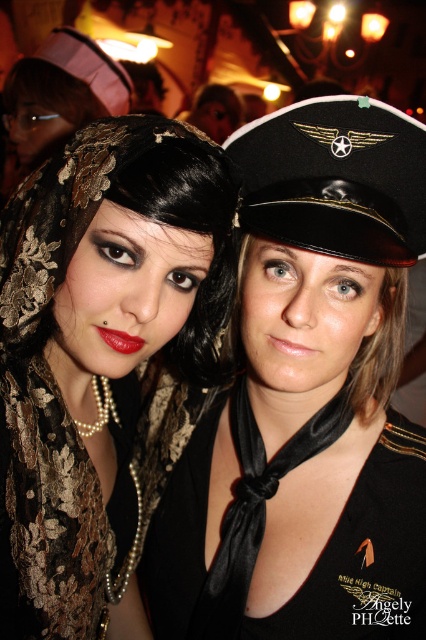
Question: Which point is farther from the camera taking this photo?

Choices:
 (A) (325, 241)
 (B) (118, 104)
 (C) (249, 148)
 (D) (129, 148)

Answer: (B)

Question: Among these points, which one is nearest to the camera?

Choices:
 (A) (95, 449)
 (B) (382, 193)
 (C) (325, 560)
 (D) (57, 38)

Answer: (B)

Question: Is black satin scarf at center positioned behind black leather cap at center?

Choices:
 (A) no
 (B) yes

Answer: (B)

Question: Does gold lace dress at center have a lesser width compared to pink fabric hat at upper left?

Choices:
 (A) no
 (B) yes

Answer: (B)

Question: Which object is positioned farthest from the black lace headscarf at upper left?

Choices:
 (A) black satin scarf at center
 (B) gold lace dress at center
 (C) black leather cap at center

Answer: (C)

Question: Is gold lace dress at center above pink fabric hat at upper left?

Choices:
 (A) no
 (B) yes

Answer: (A)